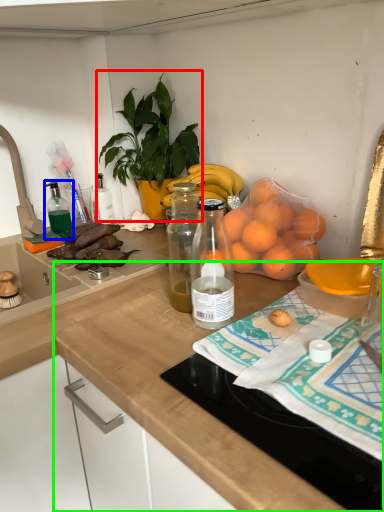
Question: Which object is positioned farthest from houseplant (highlighted by a red box)? Select from bottle (highlighted by a blue box) and countertop (highlighted by a green box).

Choices:
 (A) bottle
 (B) countertop

Answer: (B)